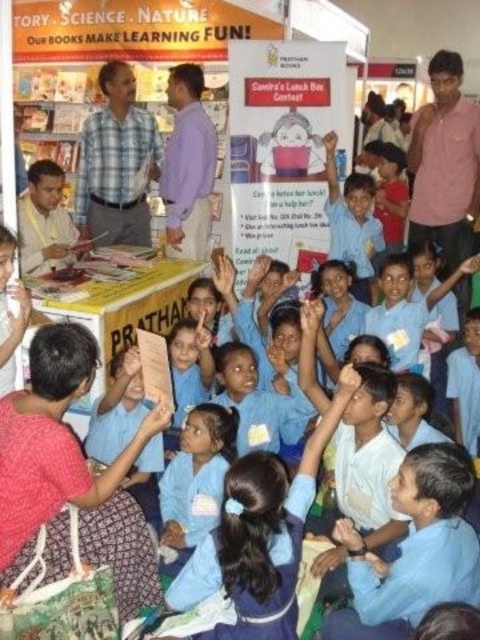
Question: Which object is farther from the camera taking this photo?

Choices:
 (A) blue uniform shirt at center
 (B) light blue plaid shirt at center
 (C) pink cotton shirt at upper right

Answer: (B)

Question: Where is blue uniform shirt at center located in relation to purple shirt at center in the image?

Choices:
 (A) right
 (B) left

Answer: (A)

Question: Which of the following is the farthest from the observer?

Choices:
 (A) pyautogui.click(x=84, y=177)
 (B) pyautogui.click(x=216, y=161)
 (C) pyautogui.click(x=434, y=467)

Answer: (B)

Question: Considering the relative positions of pink cotton shirt at upper right and purple shirt at center in the image provided, where is pink cotton shirt at upper right located with respect to purple shirt at center?

Choices:
 (A) left
 (B) right

Answer: (B)

Question: Which point appears farthest from the camera in this image?

Choices:
 (A) (127, 164)
 (B) (168, 200)
 (C) (410, 600)

Answer: (B)

Question: Can you confirm if light blue plaid shirt at center is wider than purple shirt at center?

Choices:
 (A) yes
 (B) no

Answer: (A)